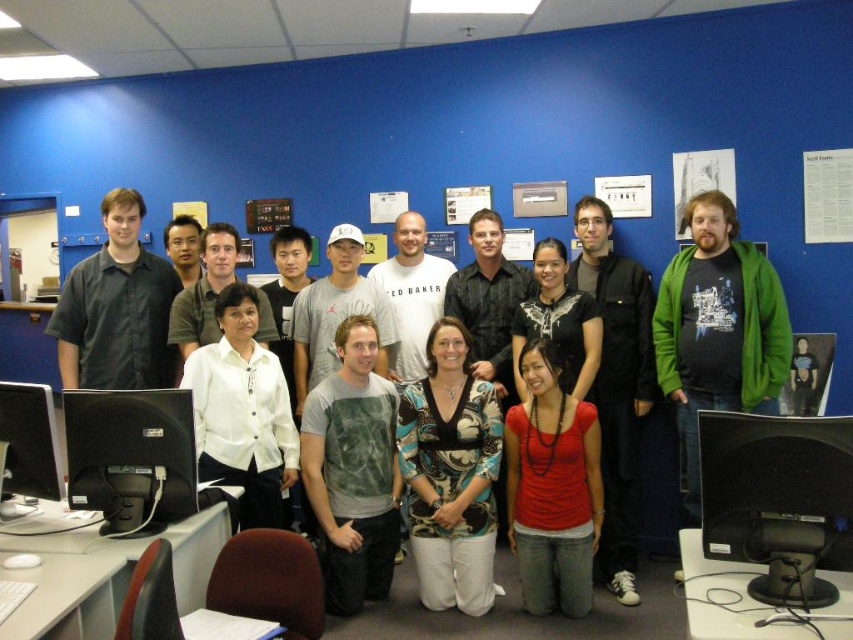
Looking at this image, does red matte shirt at center appear on the left side of black glossy monitor at left?

No, red matte shirt at center is not to the left of black glossy monitor at left.

Looking at this image, does red matte shirt at center appear on the right side of black glossy monitor at left?

Indeed, red matte shirt at center is positioned on the right side of black glossy monitor at left.

Which is in front, point (543, 577) or point (57, 470)?

Point (57, 470)

Where is `red matte shirt at center`? red matte shirt at center is located at coordinates (552, 488).

Is matte black jacket at center shorter than matte black shirt at left?

No, matte black jacket at center is not shorter than matte black shirt at left.

The image size is (853, 640). What do you see at coordinates (616, 385) in the screenshot? I see `matte black jacket at center` at bounding box center [616, 385].

Which is in front, point (631, 385) or point (84, 285)?

Positioned in front is point (84, 285).

Find the location of a particular element. The height and width of the screenshot is (640, 853). matte black jacket at center is located at coordinates (616, 385).

Does patterned fabric blouse at center appear on the right side of red matte shirt at center?

In fact, patterned fabric blouse at center is to the left of red matte shirt at center.

Does patterned fabric blouse at center lie in front of red matte shirt at center?

No, patterned fabric blouse at center is further to the viewer.

Is point (489, 557) more distant than point (572, 532)?

Yes, it is behind point (572, 532).

Where is `patterned fabric blouse at center`? This screenshot has width=853, height=640. patterned fabric blouse at center is located at coordinates (451, 474).